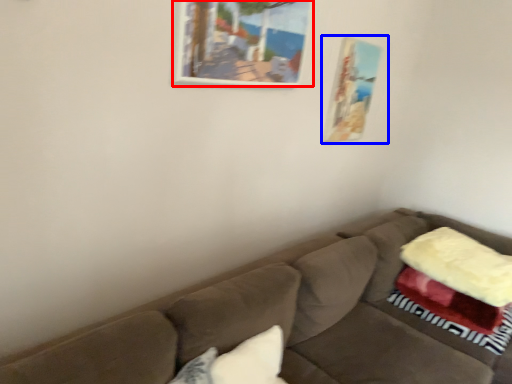
Question: Which object is further to the camera taking this photo, picture frame (highlighted by a red box) or picture frame (highlighted by a blue box)?

Choices:
 (A) picture frame
 (B) picture frame

Answer: (B)